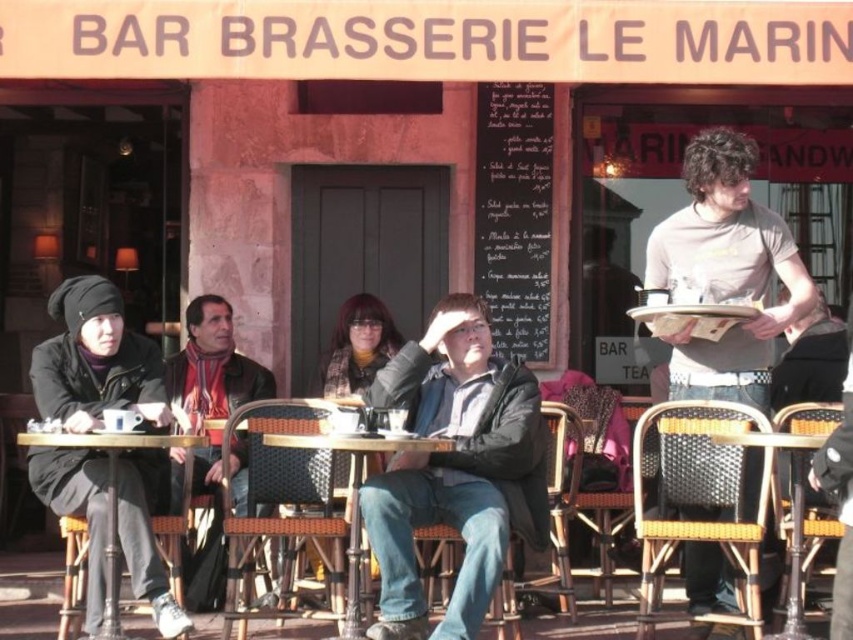
Question: Which of these objects is positioned closest to the gray t-shirt at right?

Choices:
 (A) wooden table at lower left
 (B) woven wicker table at center
 (C) leather jacket at center

Answer: (B)

Question: Where is leather jacket at center located in relation to wooden table at lower left in the image?

Choices:
 (A) left
 (B) right

Answer: (B)

Question: Which object is closer to the camera taking this photo?

Choices:
 (A) dark brown leather jacket at center
 (B) woven wicker table at center

Answer: (B)

Question: Which object is closer to the camera taking this photo?

Choices:
 (A) leather jacket at center
 (B) gray t-shirt at right

Answer: (A)

Question: Does dark brown leather jacket at center have a smaller size compared to woven wicker table at center?

Choices:
 (A) yes
 (B) no

Answer: (B)

Question: Does dark brown leather jacket at center appear on the right side of wooden table at lower left?

Choices:
 (A) yes
 (B) no

Answer: (A)